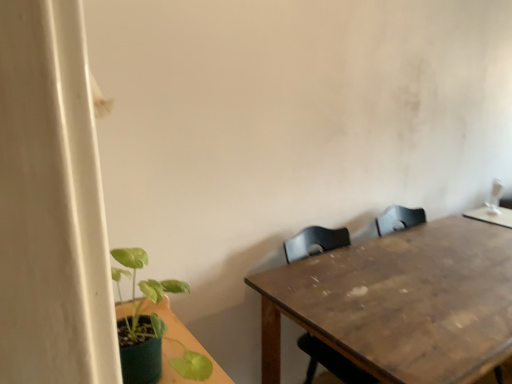
In the scene shown: Measure the distance between wooden table at center and camera.

wooden table at center is 1.07 meters away from camera.

Locate an element on the screen. This screenshot has width=512, height=384. wooden table at center is located at coordinates (401, 302).

What do you see at coordinates (401, 302) in the screenshot?
I see `wooden table at center` at bounding box center [401, 302].

Find the location of a particular element. This screenshot has width=512, height=384. green matte plant at lower left is located at coordinates (150, 326).

The width and height of the screenshot is (512, 384). What do you see at coordinates (150, 326) in the screenshot? I see `green matte plant at lower left` at bounding box center [150, 326].

This screenshot has width=512, height=384. I want to click on wooden table at center, so click(x=401, y=302).

Is green matte plant at lower left to the right of wooden table at center from the viewer's perspective?

Incorrect, green matte plant at lower left is not on the right side of wooden table at center.

Which is behind, green matte plant at lower left or wooden table at center?

wooden table at center.

Does point (144, 325) come behind point (486, 362)?

No, it is in front of (486, 362).

Based on the photo, from the image's perspective, is green matte plant at lower left on top of wooden table at center?

Yes, from the image's perspective, green matte plant at lower left is over wooden table at center.

From a real-world perspective, does green matte plant at lower left stand above wooden table at center?

Correct, in the physical world, green matte plant at lower left is higher than wooden table at center.

Is green matte plant at lower left wider or thinner than wooden table at center?

green matte plant at lower left is thinner than wooden table at center.

From their relative heights in the image, would you say green matte plant at lower left is taller or shorter than wooden table at center?

In the image, green matte plant at lower left appears to be shorter than wooden table at center.

Who is smaller, green matte plant at lower left or wooden table at center?

Smaller between the two is green matte plant at lower left.

Is green matte plant at lower left inside or outside of wooden table at center?

green matte plant at lower left cannot be found inside wooden table at center.

Looking at this image, are green matte plant at lower left and wooden table at center located far from each other?

No, green matte plant at lower left is in close proximity to wooden table at center.

Is green matte plant at lower left aimed at wooden table at center?

Yes, green matte plant at lower left faces towards wooden table at center.

How far apart are green matte plant at lower left and wooden table at center?

A distance of 33.97 inches exists between green matte plant at lower left and wooden table at center.

The height and width of the screenshot is (384, 512). I want to click on table behind the green matte plant at lower left, so click(401, 302).

Would you say wooden table at center is to the left or to the right of green matte plant at lower left in the picture?

Clearly, wooden table at center is on the right of green matte plant at lower left in the image.

Considering the relative positions of wooden table at center and green matte plant at lower left in the image provided, is wooden table at center in front of green matte plant at lower left?

No, it is behind green matte plant at lower left.

Is point (287, 283) closer or farther from the camera than point (196, 372)?

Point (287, 283) appears to be farther away from the viewer than point (196, 372).

Based on the photo, from the image's perspective, is wooden table at center located above or below green matte plant at lower left?

Based on their image positions, wooden table at center is located beneath green matte plant at lower left.

From a real-world perspective, is wooden table at center above or below green matte plant at lower left?

wooden table at center is below green matte plant at lower left.

In terms of width, does wooden table at center look wider or thinner when compared to green matte plant at lower left?

Considering their sizes, wooden table at center looks broader than green matte plant at lower left.

Is wooden table at center taller than green matte plant at lower left?

Yes, wooden table at center is taller than green matte plant at lower left.

Who is smaller, wooden table at center or green matte plant at lower left?

Smaller between the two is green matte plant at lower left.

Is wooden table at center outside of green matte plant at lower left?

That's correct, wooden table at center is outside of green matte plant at lower left.

From the picture: Is there a large distance between wooden table at center and green matte plant at lower left?

wooden table at center is near green matte plant at lower left, not far away.

Is wooden table at center looking in the opposite direction of green matte plant at lower left?

That's not correct — wooden table at center is not looking away from green matte plant at lower left.

In the scene shown: Can you tell me how much wooden table at center and green matte plant at lower left differ in facing direction?

There is a 87.3-degree angle between the facing directions of wooden table at center and green matte plant at lower left.

How far apart are wooden table at center and green matte plant at lower left?

The distance of wooden table at center from green matte plant at lower left is 33.97 inches.

This screenshot has height=384, width=512. Identify the location of houseplant on the left of the wooden table at center. (150, 326).

You are a GUI agent. You are given a task and a screenshot of the screen. Output one action in this format:
    pyautogui.click(x=<x>, y=<y>)
    Task: Click on the houseplant that appears above the wooden table at center (from a real-world perspective)
    The width and height of the screenshot is (512, 384).
    Given the screenshot: What is the action you would take?
    pyautogui.click(x=150, y=326)

You are a GUI agent. You are given a task and a screenshot of the screen. Output one action in this format:
    pyautogui.click(x=<x>, y=<y>)
    Task: Click on the houseplant lying on the left of wooden table at center
    
    Given the screenshot: What is the action you would take?
    pyautogui.click(x=150, y=326)